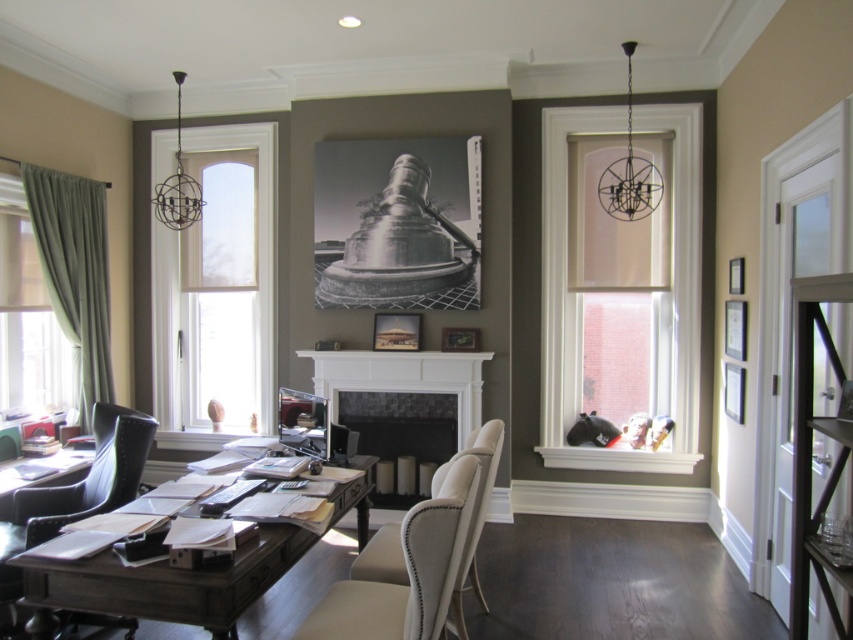
You are an office worker who needs to move a large box from the desk to the chair. Considering the space between them, will the box fit through the area between the dark wood desk at center and the black leather chair at lower left?

The dark wood desk at center is wider than the black leather chair at lower left, so the space between them may be sufficient for the large box to pass through, but the exact dimensions of the box and the gap are needed for a precise determination.

You are an interior designer planning to place a new rug in the office. The rug must be placed between the white marble fireplace at center and the beige fabric chair at center. Can you confirm if the fireplace is above the chair to ensure proper placement?

The white marble fireplace at center is located above the beige fabric chair at center, so placing the rug between them would require positioning it below the fireplace and in front of the chair.